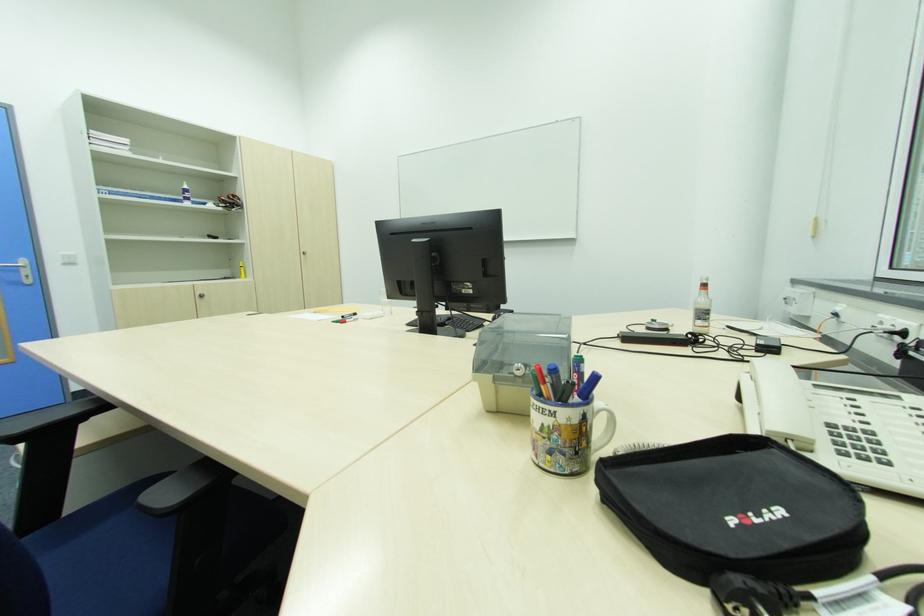
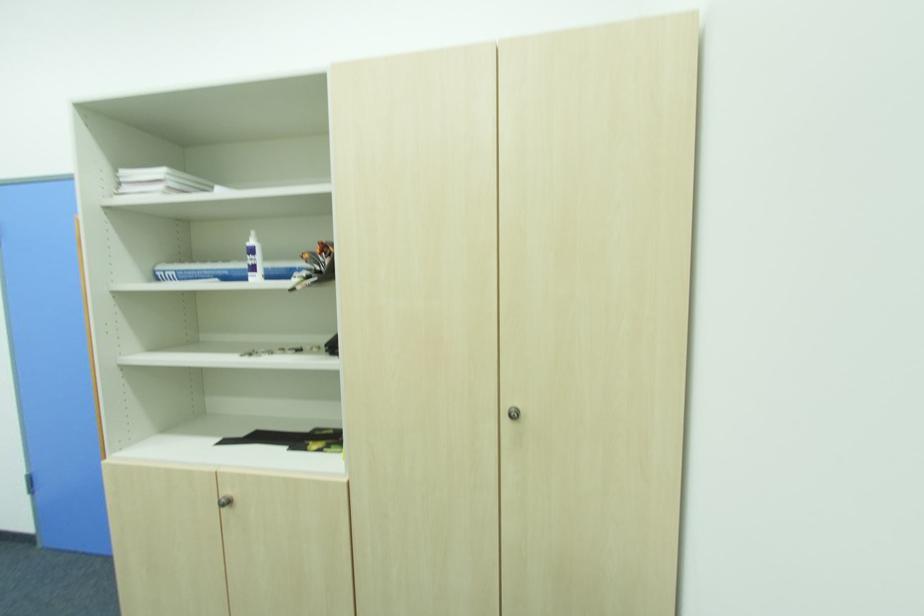
Find the pixel in the second image that matches (128,142) in the first image.

(161, 172)